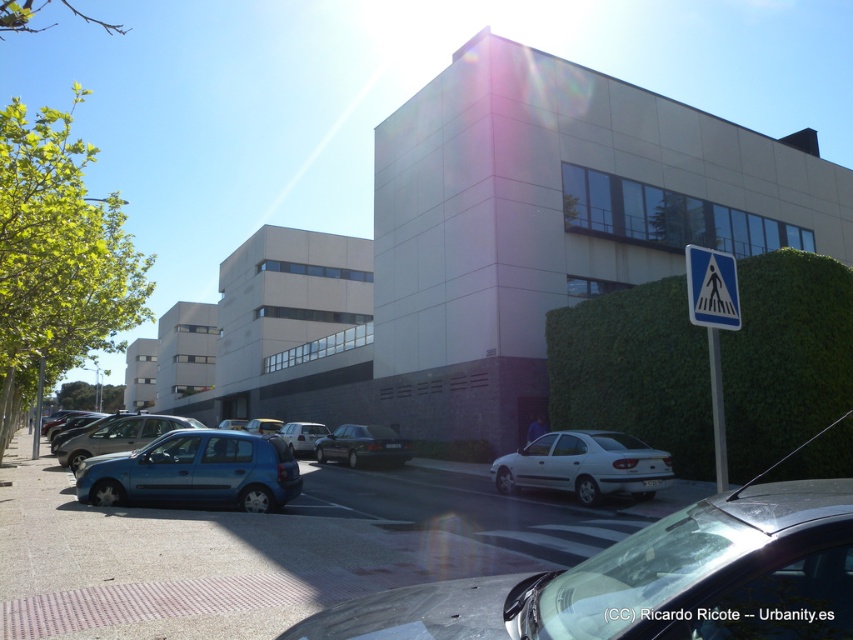
You are standing at the origin point of the image coordinate system. You want to locate the white matte sedan at center. What are its coordinates?

The white matte sedan at center is located at coordinates point [584,465].

Based on the photo, you are a delivery driver trying to park your white matte sedan at center in a spot that is currently occupied by the white plastic pedestrian crossing sign at lower right. Can you park your car there without moving the sign?

The white plastic pedestrian crossing sign at lower right occupies more space than the white matte sedan at center. Since the sign takes up more area, the sedan can fit in the parking spot without needing to move the sign.

From the picture: You are a delivery person needing to cross the street safely. You see the white matte sedan at center and the white plastic pedestrian crossing sign at lower right. Which object should you approach first to ensure you are at the designated pedestrian area?

The white plastic pedestrian crossing sign at lower right indicates the designated area for pedestrians. Since the white matte sedan at center is on the left side of the sign, you should approach the white plastic pedestrian crossing sign at lower right first to reach the correct crossing point.